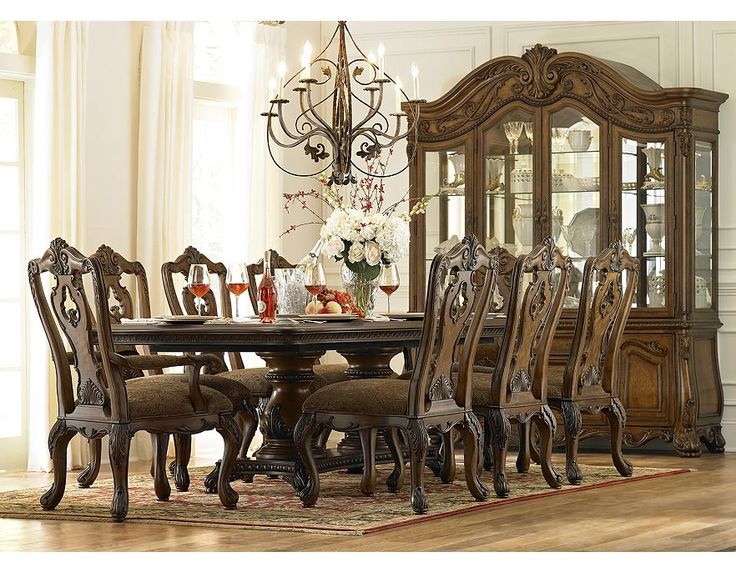
Image resolution: width=736 pixels, height=572 pixels. Identify the location of arms of the candelabra hanging above table. (294, 140), (282, 123), (302, 99), (308, 86), (368, 92), (378, 95), (396, 122), (414, 102).